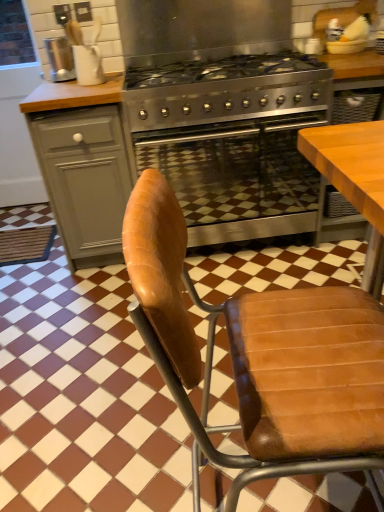
Where is `free region on the left part of white matte mug at upper left`? The width and height of the screenshot is (384, 512). free region on the left part of white matte mug at upper left is located at coordinates (60, 86).